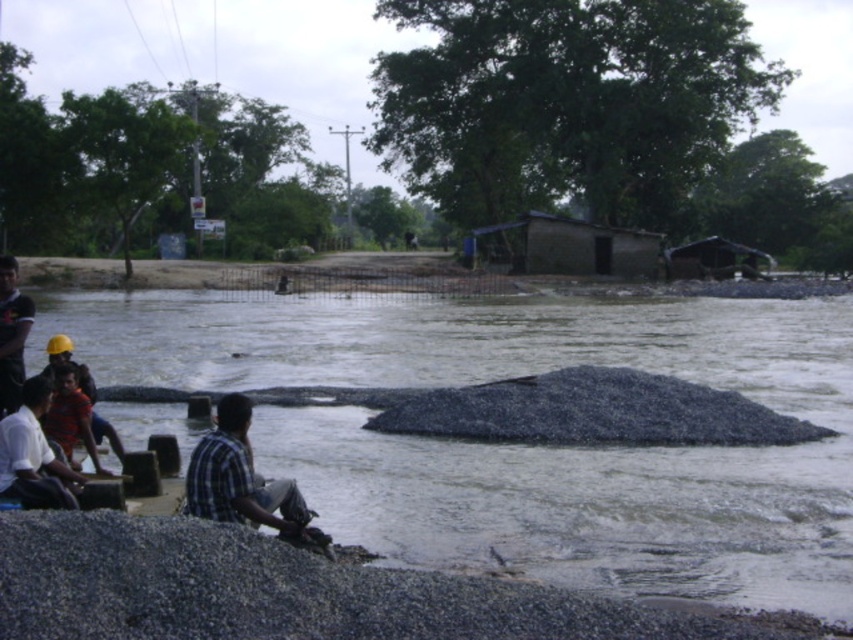
Does point (821, 371) lie in front of point (15, 369)?

No, (821, 371) is behind (15, 369).

Can you confirm if gray gravel river at center is bigger than dark blue plaid shirt at left?

Yes, gray gravel river at center is bigger than dark blue plaid shirt at left.

The image size is (853, 640). Find the location of `gray gravel river at center`. gray gravel river at center is located at coordinates (524, 444).

Can you confirm if gray gravel at lower left is positioned below brown corrugated metal hut at center right?

Indeed, gray gravel at lower left is positioned under brown corrugated metal hut at center right.

This screenshot has height=640, width=853. Describe the element at coordinates (287, 592) in the screenshot. I see `gray gravel at lower left` at that location.

Find the location of a particular element. This screenshot has height=640, width=853. gray gravel at lower left is located at coordinates (287, 592).

Who is more distant from viewer, [556,250] or [715,273]?

Positioned behind is point [715,273].

Can you confirm if dark brown mud hut at center is smaller than brown corrugated metal hut at center right?

Correct, dark brown mud hut at center occupies less space than brown corrugated metal hut at center right.

Is point (467, 248) more distant than point (669, 259)?

Yes, point (467, 248) is farther from viewer.

Where is `dark brown mud hut at center`? This screenshot has width=853, height=640. dark brown mud hut at center is located at coordinates (572, 248).